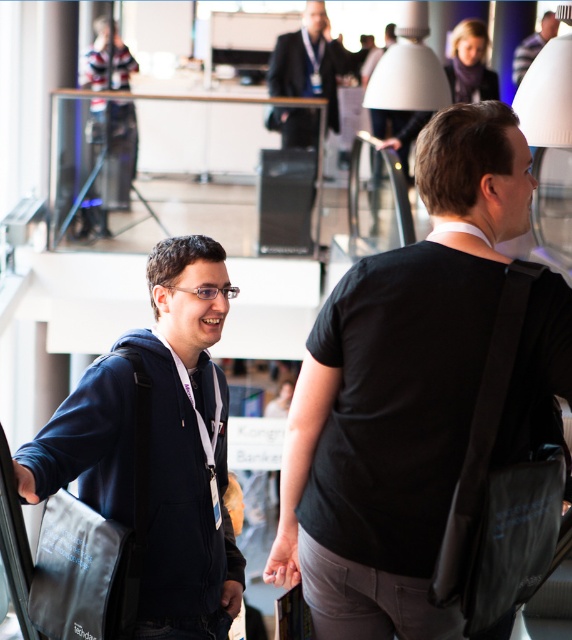
Does black matte bag at center have a smaller size compared to dark suit at upper center?

No.

Between black matte bag at center and dark suit at upper center, which one appears on the left side from the viewer's perspective?

From the viewer's perspective, dark suit at upper center appears more on the left side.

Locate an element on the screen. black matte bag at center is located at coordinates (399, 390).

Is the position of dark blue hoodie at center less distant than that of dark suit at upper center?

Yes.

Is dark blue hoodie at center taller than dark suit at upper center?

Yes, dark blue hoodie at center is taller than dark suit at upper center.

Does point (219, 412) come farther from viewer compared to point (276, 54)?

No, (219, 412) is in front of (276, 54).

Image resolution: width=572 pixels, height=640 pixels. What are the coordinates of `dark blue hoodie at center` in the screenshot? It's located at (186, 448).

Between black matte bag at center and matte black backpack at upper right, which one appears on the right side from the viewer's perspective?

Positioned to the right is matte black backpack at upper right.

Who is shorter, black matte bag at center or matte black backpack at upper right?

Standing shorter between the two is matte black backpack at upper right.

What do you see at coordinates (399, 390) in the screenshot? I see `black matte bag at center` at bounding box center [399, 390].

The image size is (572, 640). What are the coordinates of `black matte bag at center` in the screenshot? It's located at (399, 390).